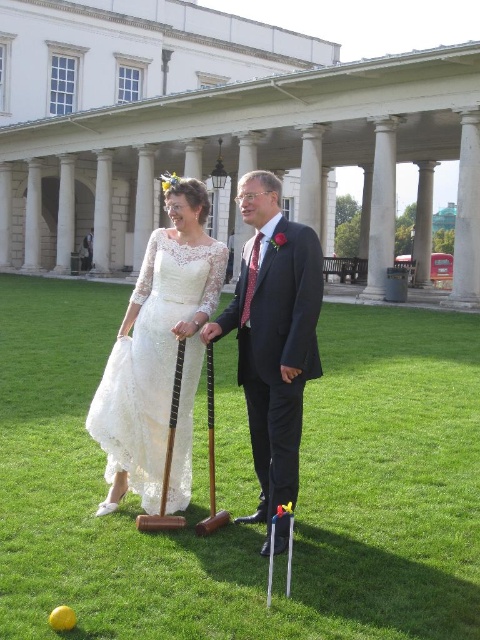
Question: Can you confirm if matte black suit at center is positioned below lace dress at center?

Choices:
 (A) no
 (B) yes

Answer: (B)

Question: Can you confirm if green grass at center is positioned above lace dress at center?

Choices:
 (A) no
 (B) yes

Answer: (A)

Question: Among these points, which one is nearest to the camera?

Choices:
 (A) (241, 346)
 (B) (168, 314)

Answer: (B)

Question: Among these objects, which one is nearest to the camera?

Choices:
 (A) green grass at center
 (B) lace dress at center

Answer: (A)

Question: Is green grass at center closer to the viewer compared to matte black suit at center?

Choices:
 (A) yes
 (B) no

Answer: (A)

Question: Estimate the real-world distances between objects in this image. Which object is closer to the matte black suit at center?

Choices:
 (A) green grass at center
 (B) lace dress at center

Answer: (B)